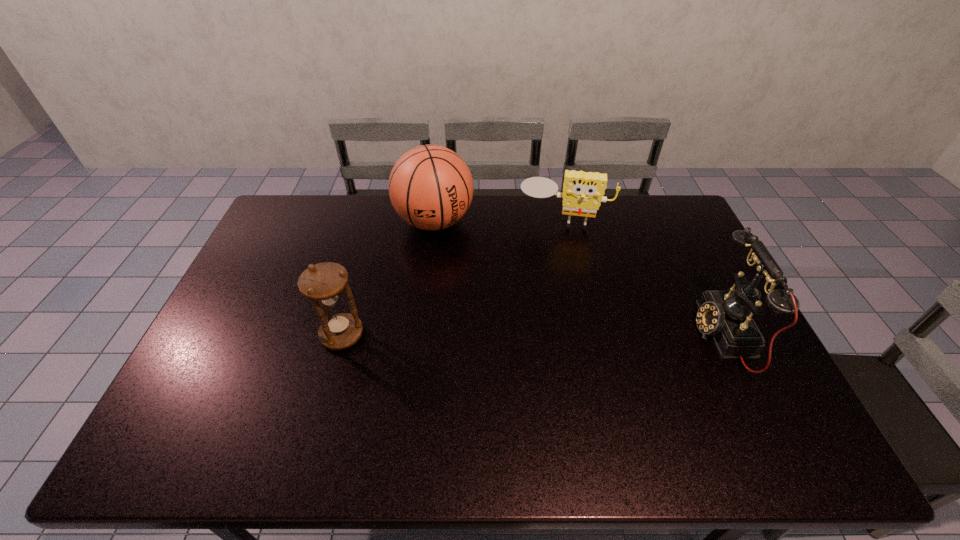
The height and width of the screenshot is (540, 960). What are the coordinates of `vacant space located on the front-facing side of the sponge` in the screenshot? It's located at (x=555, y=260).

I want to click on free space located 0.240m on the surface of the third object from right to left near the brand logo, so click(x=465, y=295).

Find the location of a particular element. This screenshot has width=960, height=540. blank space located 0.050m on the surface of the third object from right to left near the brand logo is located at coordinates (448, 255).

Find the location of `vacant space located 0.090m on the surface of the third object from right to left near the brand logo`. vacant space located 0.090m on the surface of the third object from right to left near the brand logo is located at coordinates (451, 264).

The height and width of the screenshot is (540, 960). I want to click on sponge located in the far edge section of the desktop, so click(x=583, y=192).

At what (x,y) coordinates should I click in order to perform the action: click on basketball present at the far edge. Please return your answer as a coordinate pair (x, y). Image resolution: width=960 pixels, height=540 pixels. Looking at the image, I should click on (430, 186).

Where is `object situated at the near edge`? object situated at the near edge is located at coordinates (726, 315).

Where is `object located at the right edge`? The image size is (960, 540). object located at the right edge is located at coordinates (726, 315).

I want to click on object situated at the near right corner, so coord(726,315).

Identify the location of free point at the far edge. The height and width of the screenshot is (540, 960). (574, 231).